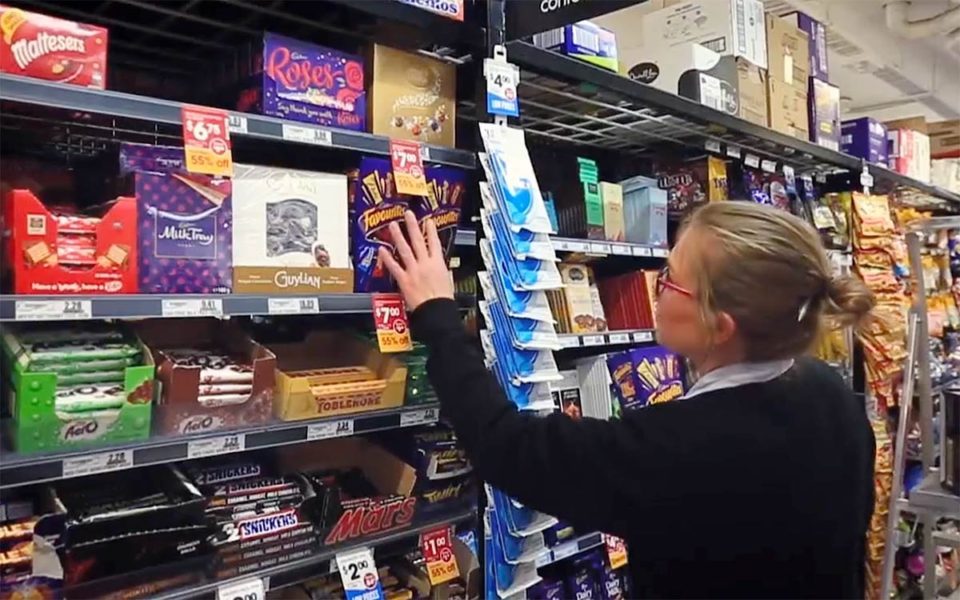
You are a GUI agent. You are given a task and a screenshot of the screen. Output one action in this format:
    pyautogui.click(x=<x>, y=<y>)
    Task: Click on the ceiling
    The height and width of the screenshot is (600, 960).
    Given the screenshot: What is the action you would take?
    pyautogui.click(x=870, y=41)